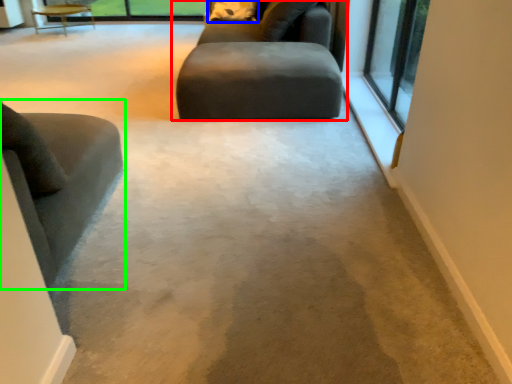
Question: Which object is positioned farthest from studio couch (highlighted by a red box)? Select from pillow (highlighted by a blue box) and chair (highlighted by a green box).

Choices:
 (A) pillow
 (B) chair

Answer: (B)